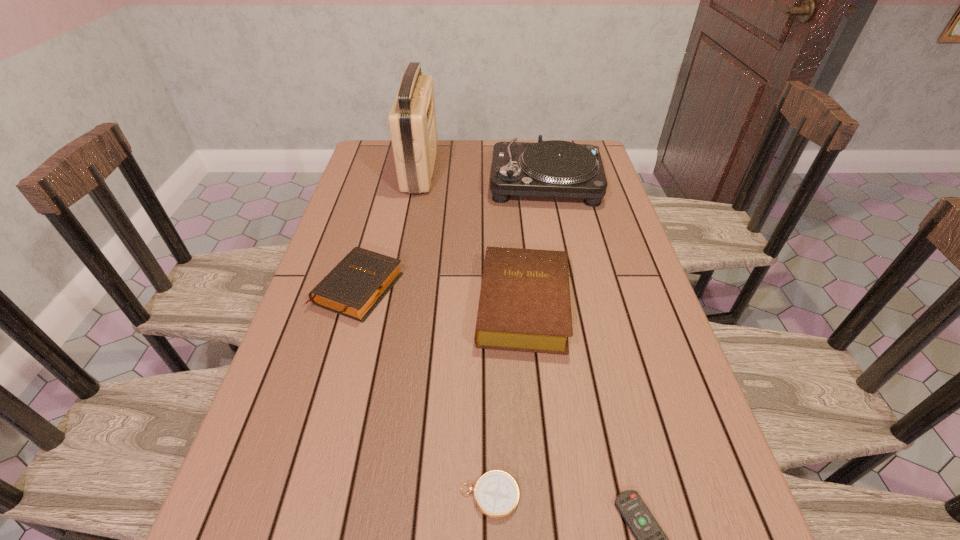
Image resolution: width=960 pixels, height=540 pixels. I want to click on free spot that satisfies the following two spatial constraints: 1. on the front-facing side of the radio receiver; 2. on the right side of the second shortest object, so click(x=358, y=496).

Image resolution: width=960 pixels, height=540 pixels. In order to click on free location that satisfies the following two spatial constraints: 1. on the back side of the fourth shortest object; 2. on the front-facing side of the radio receiver in this screenshot , I will do `click(510, 168)`.

Image resolution: width=960 pixels, height=540 pixels. Find the location of `free space that satisfies the following two spatial constraints: 1. on the front-facing side of the tallest object; 2. on the right side of the taller Bible`. free space that satisfies the following two spatial constraints: 1. on the front-facing side of the tallest object; 2. on the right side of the taller Bible is located at coordinates (394, 306).

I want to click on free region that satisfies the following two spatial constraints: 1. on the back side of the fifth shortest object; 2. on the left side of the shorter Bible, so click(x=388, y=184).